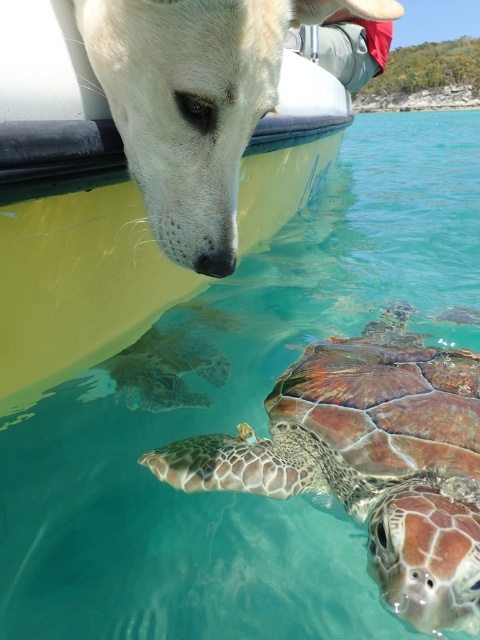
Locate an element on the screen. The image size is (480, 640). brown textured shell at lower center is located at coordinates (370, 461).

Is brown textured shell at lower center taller than white matte dog at upper left?

No, brown textured shell at lower center is not taller than white matte dog at upper left.

I want to click on brown textured shell at lower center, so click(x=370, y=461).

At what (x,y) coordinates should I click in order to perform the action: click on brown textured shell at lower center. Please return your answer as a coordinate pair (x, y). Looking at the image, I should click on (370, 461).